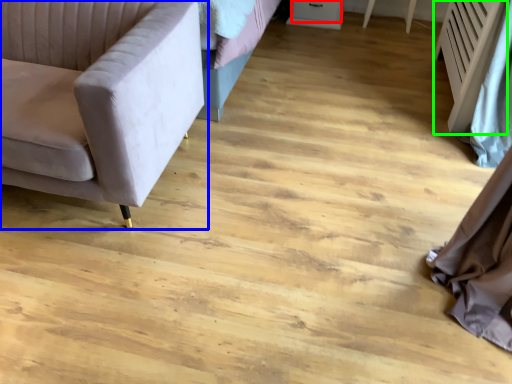
Question: Which object is the closest to the drawer (highlighted by a red box)? Choose among these: studio couch (highlighted by a blue box) or radiator (highlighted by a green box).

Choices:
 (A) studio couch
 (B) radiator

Answer: (B)